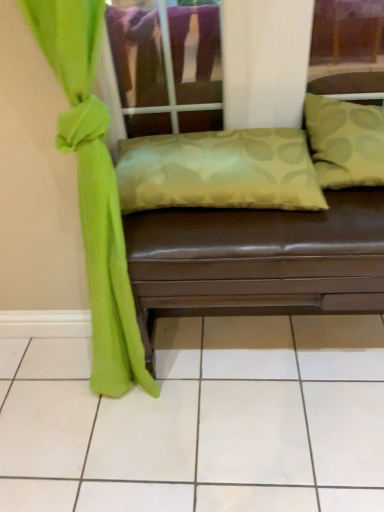
Question: Considering the relative positions of satin green pillow at center, placed as the 1th pillow when sorted from left to right, and green fabric pillow at upper right, which ranks as the 1th pillow in right-to-left order, in the image provided, is satin green pillow at center, placed as the 1th pillow when sorted from left to right, to the left or to the right of green fabric pillow at upper right, which ranks as the 1th pillow in right-to-left order,?

Choices:
 (A) right
 (B) left

Answer: (B)

Question: From the image's perspective, is satin green pillow at center, placed as the 2th pillow when sorted from right to left, positioned above or below green fabric pillow at upper right, which ranks as the 1th pillow in right-to-left order?

Choices:
 (A) above
 (B) below

Answer: (B)

Question: Which object is positioned farthest from the green fabric pillow at upper right, which ranks as the 1th pillow in right-to-left order?

Choices:
 (A) green fabric curtain at left
 (B) satin green pillow at center, placed as the 1th pillow when sorted from left to right
 (C) silky green pillow at center

Answer: (A)

Question: Which is nearer to the green fabric pillow at upper right, which ranks as the 1th pillow in right-to-left order?

Choices:
 (A) satin green pillow at center, placed as the 1th pillow when sorted from left to right
 (B) silky green pillow at center
 (C) green fabric curtain at left

Answer: (A)